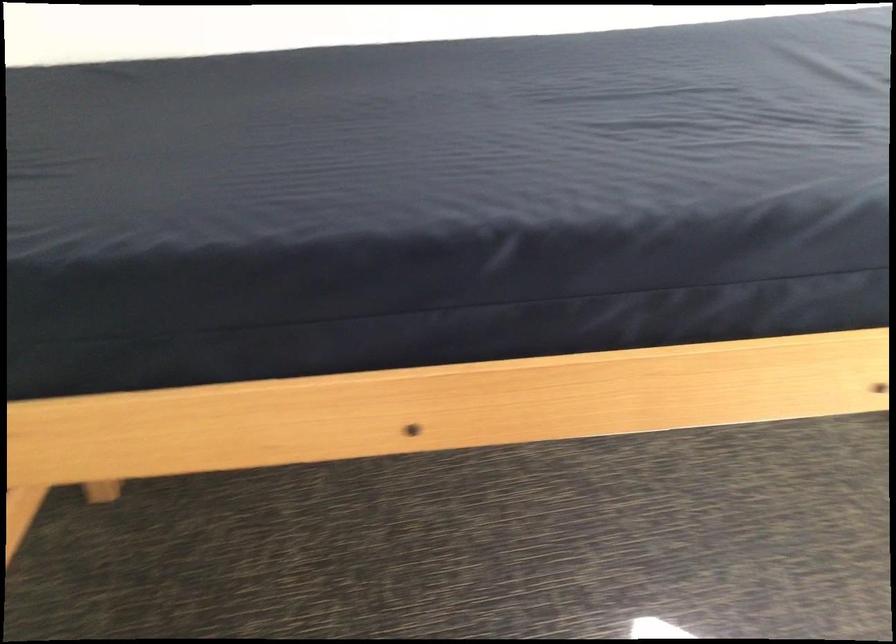
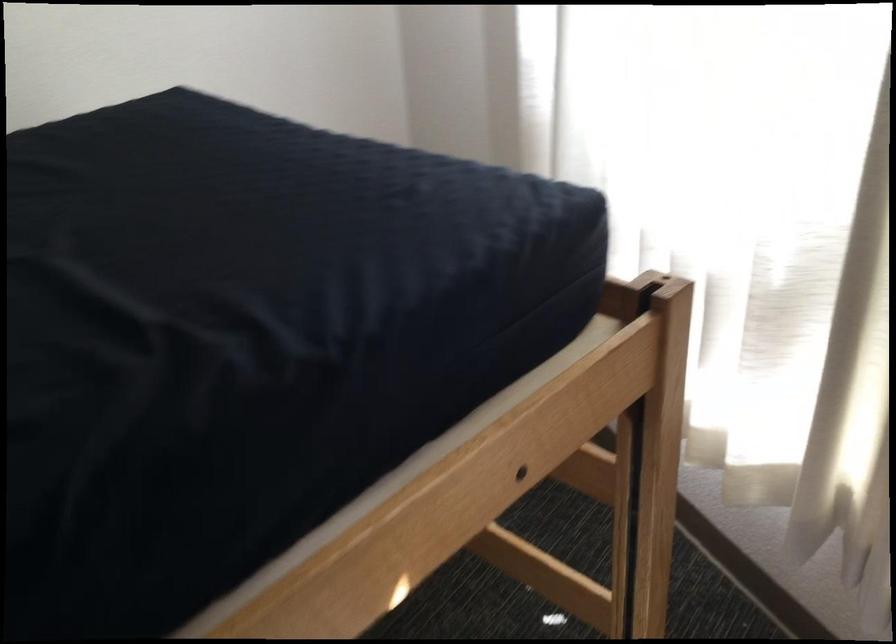
Question: The camera is either moving clockwise (left) or counter-clockwise (right) around the object. The first image is from the beginning of the video and the second image is from the end. Is the camera moving left or right when shooting the video?

Choices:
 (A) Left
 (B) Right

Answer: (A)